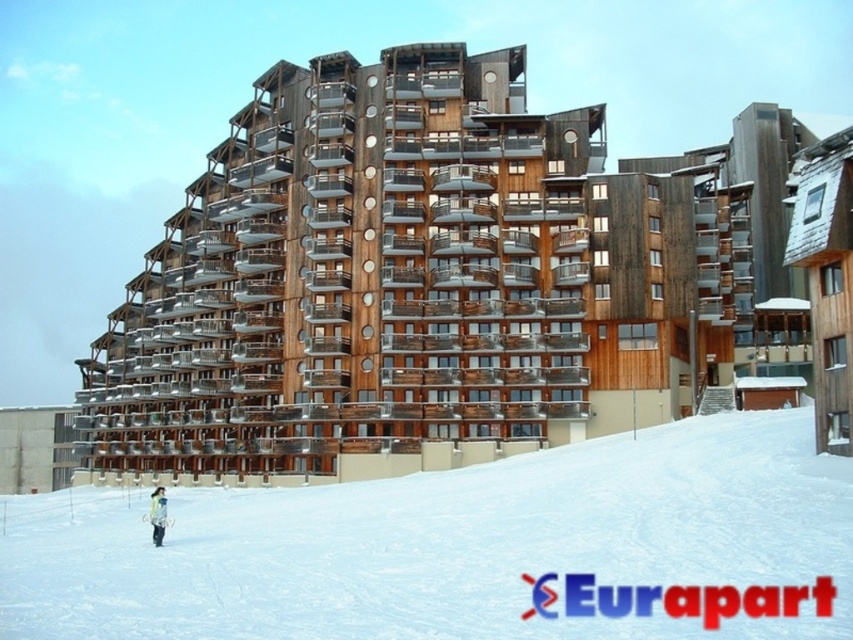
Question: Can you confirm if white powdery snow at center is positioned below white plastic ski at lower left?

Choices:
 (A) no
 (B) yes

Answer: (A)

Question: Considering the relative positions of wooden building at center and light brown fur coat at lower left in the image provided, where is wooden building at center located with respect to light brown fur coat at lower left?

Choices:
 (A) below
 (B) above

Answer: (B)

Question: Among these objects, which one is nearest to the camera?

Choices:
 (A) white plastic ski at lower left
 (B) white powdery snow at center
 (C) wooden building at center

Answer: (B)

Question: Which point is farther from the camera taking this photo?

Choices:
 (A) (161, 518)
 (B) (753, 157)

Answer: (B)

Question: Which object is positioned farthest from the light brown fur coat at lower left?

Choices:
 (A) wooden building at center
 (B) white plastic ski at lower left

Answer: (A)

Question: Is wooden building at center to the left of white powdery snow at center from the viewer's perspective?

Choices:
 (A) no
 (B) yes

Answer: (A)